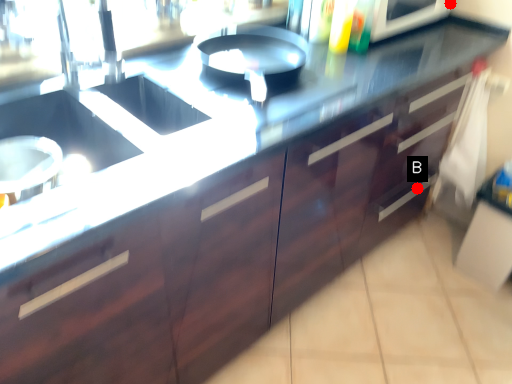
Question: Two points are circled on the image, labeled by A and B beside each circle. Which point is closer to the camera?

Choices:
 (A) A is closer
 (B) B is closer

Answer: (A)